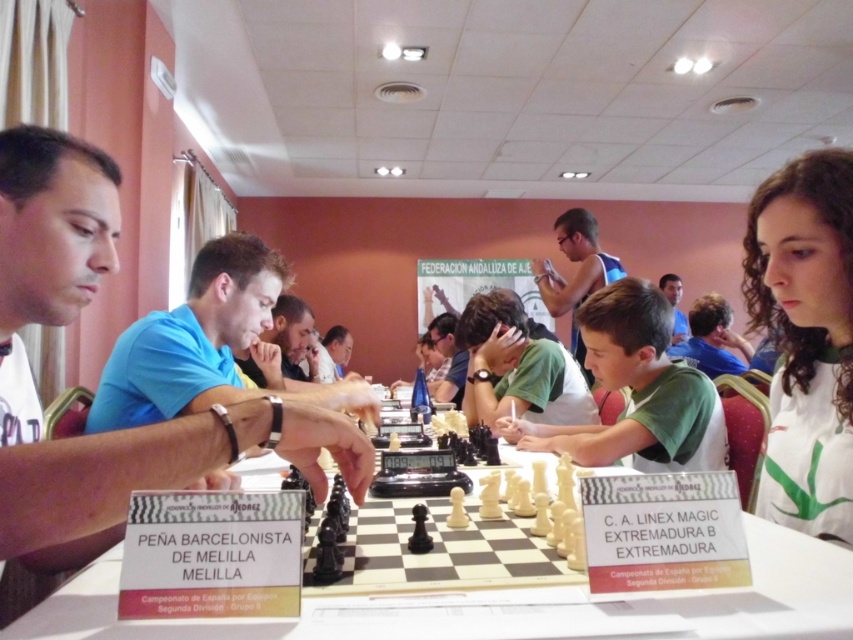
Based on the photo, is white jersey at upper right taller than blue shirt at center?

In fact, white jersey at upper right may be shorter than blue shirt at center.

Which is more to the left, white jersey at upper right or blue shirt at center?

From the viewer's perspective, white jersey at upper right appears more on the left side.

Does point (830, 436) come in front of point (680, 288)?

Yes, it is.

Locate an element on the screen. The height and width of the screenshot is (640, 853). white jersey at upper right is located at coordinates (805, 339).

Between green matte shirt at center and blue shirt at center, which one has more height?

Standing taller between the two is blue shirt at center.

Is the position of green matte shirt at center more distant than that of blue shirt at center?

No, it is in front of blue shirt at center.

Is point (672, 372) less distant than point (676, 321)?

Yes, point (672, 372) is closer to viewer.

The image size is (853, 640). Identify the location of green matte shirt at center. [636, 392].

Does blue fabric shirt at center have a greater height compared to blue tank top at upper center?

No, blue fabric shirt at center is not taller than blue tank top at upper center.

Is blue fabric shirt at center above blue tank top at upper center?

No, blue fabric shirt at center is not above blue tank top at upper center.

You are a GUI agent. You are given a task and a screenshot of the screen. Output one action in this format:
    pyautogui.click(x=<x>, y=<y>)
    Task: Click on the blue fabric shirt at center
    Image resolution: width=853 pixels, height=640 pixels.
    Given the screenshot: What is the action you would take?
    pyautogui.click(x=207, y=346)